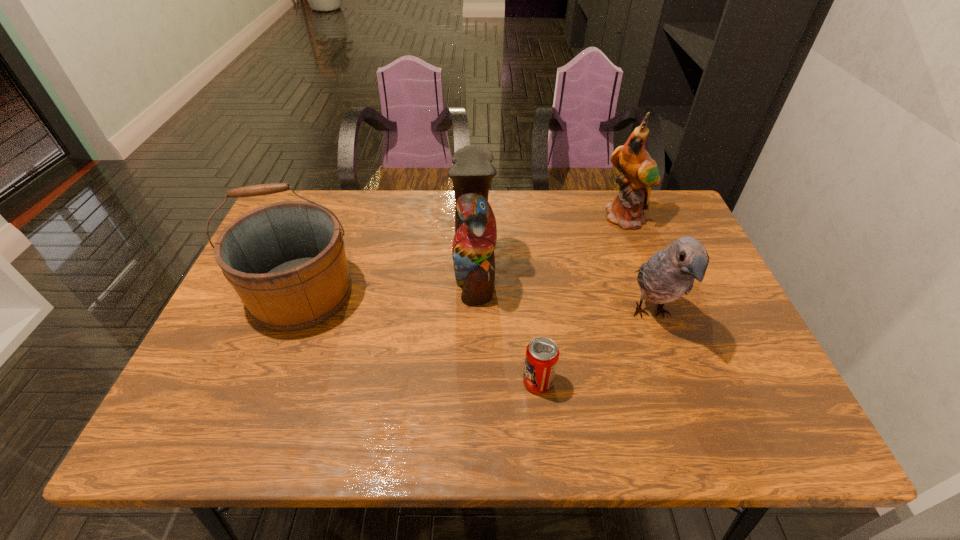
Identify the location of vacant space located on the right of the shortest object. This screenshot has width=960, height=540. (595, 382).

Identify the location of object that is at the far edge. (640, 171).

The height and width of the screenshot is (540, 960). In order to click on object that is positioned at the left edge in this screenshot , I will do `click(286, 260)`.

Identify the location of object present at the far right corner. (640, 171).

You are a GUI agent. You are given a task and a screenshot of the screen. Output one action in this format:
    pyautogui.click(x=<x>, y=<y>)
    Task: Click on the vacant space at the far edge
    The height and width of the screenshot is (540, 960).
    Given the screenshot: What is the action you would take?
    point(600,222)

Where is `vacant space at the near edge`? vacant space at the near edge is located at coordinates (574, 435).

The width and height of the screenshot is (960, 540). Find the location of `vacant position at the left edge of the desktop`. vacant position at the left edge of the desktop is located at coordinates (225, 383).

In the image, there is a desktop. Find the location of `blank space at the right edge`. blank space at the right edge is located at coordinates pos(725,378).

The width and height of the screenshot is (960, 540). In order to click on vacant region at the far right corner of the desktop in this screenshot , I will do `click(646, 235)`.

Find the location of a particular element. vacant area between the farthest object and the leftmost parrot is located at coordinates (550, 247).